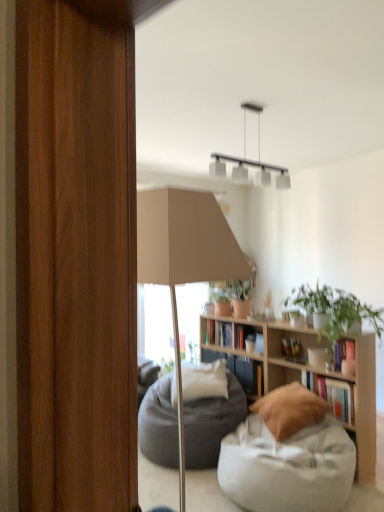
Question: Considering the relative sizes of hardcover book at center, which appears as the first book when viewed from the left, and white fabric bean bag at lower right in the image provided, is hardcover book at center, which appears as the first book when viewed from the left, shorter than white fabric bean bag at lower right?

Choices:
 (A) yes
 (B) no

Answer: (A)

Question: Is hardcover book at center, which appears as the first book when viewed from the left, not near white fabric bean bag at lower right?

Choices:
 (A) yes
 (B) no

Answer: (A)

Question: Is the depth of hardcover book at center, which appears as the first book when viewed from the left, less than that of white fabric bean bag at lower right?

Choices:
 (A) no
 (B) yes

Answer: (A)

Question: Does hardcover book at center, which appears as the third book when viewed from the front, have a larger size compared to white fabric bean bag at lower right?

Choices:
 (A) yes
 (B) no

Answer: (B)

Question: From the image's perspective, is hardcover book at center, the 3th book from the right, over white fabric bean bag at lower right?

Choices:
 (A) yes
 (B) no

Answer: (A)

Question: Choose the correct answer: Is dark gray fabric bean bag at center inside white soft pillow at center, placed as the second pillow when sorted from front to back, or outside it?

Choices:
 (A) inside
 (B) outside

Answer: (B)

Question: Looking at the image, does dark gray fabric bean bag at center seem bigger or smaller compared to white soft pillow at center, which is counted as the first pillow, starting from the left?

Choices:
 (A) small
 (B) big

Answer: (B)

Question: From a real-world perspective, relative to white soft pillow at center, which is counted as the first pillow, starting from the left, is dark gray fabric bean bag at center vertically above or below?

Choices:
 (A) below
 (B) above

Answer: (A)

Question: Is dark gray fabric bean bag at center in front of or behind white soft pillow at center, placed as the second pillow when sorted from front to back, in the image?

Choices:
 (A) behind
 (B) front

Answer: (B)

Question: From a real-world perspective, is dark gray fabric bean bag at center physically located above or below wooden bookshelf at center?

Choices:
 (A) below
 (B) above

Answer: (A)

Question: Is dark gray fabric bean bag at center inside or outside of wooden bookshelf at center?

Choices:
 (A) inside
 (B) outside

Answer: (B)

Question: Is dark gray fabric bean bag at center wider or thinner than wooden bookshelf at center?

Choices:
 (A) thin
 (B) wide

Answer: (A)

Question: Would you say dark gray fabric bean bag at center is to the left or to the right of wooden bookshelf at center in the picture?

Choices:
 (A) left
 (B) right

Answer: (A)

Question: Looking at the image, does brown suede pillow at lower center, marked as the second pillow in a left-to-right arrangement, seem bigger or smaller compared to dark gray fabric bean bag at center?

Choices:
 (A) big
 (B) small

Answer: (B)

Question: Considering the positions of brown suede pillow at lower center, which is counted as the first pillow, starting from the front, and dark gray fabric bean bag at center in the image, is brown suede pillow at lower center, which is counted as the first pillow, starting from the front, wider or thinner than dark gray fabric bean bag at center?

Choices:
 (A) wide
 (B) thin

Answer: (B)